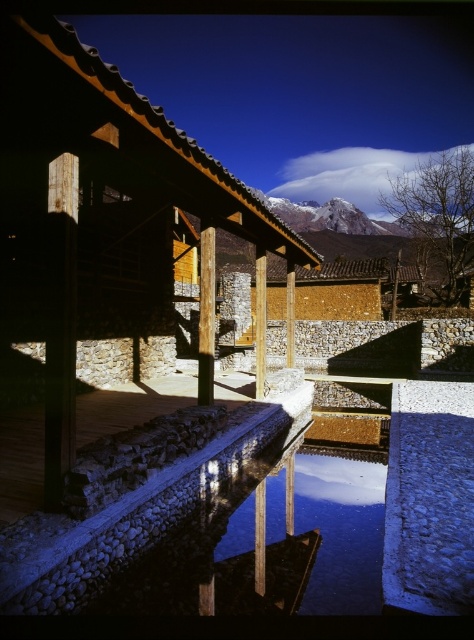
You are an architect designing a model of this scene. You have two wooden pieces labeled as the wooden post at center and the matte wood pillar at center. Which one should you choose if you need a wider support for a heavy structure?

The matte wood pillar at center is wider than the wooden post at center, so you should choose the matte wood pillar at center for a wider support.